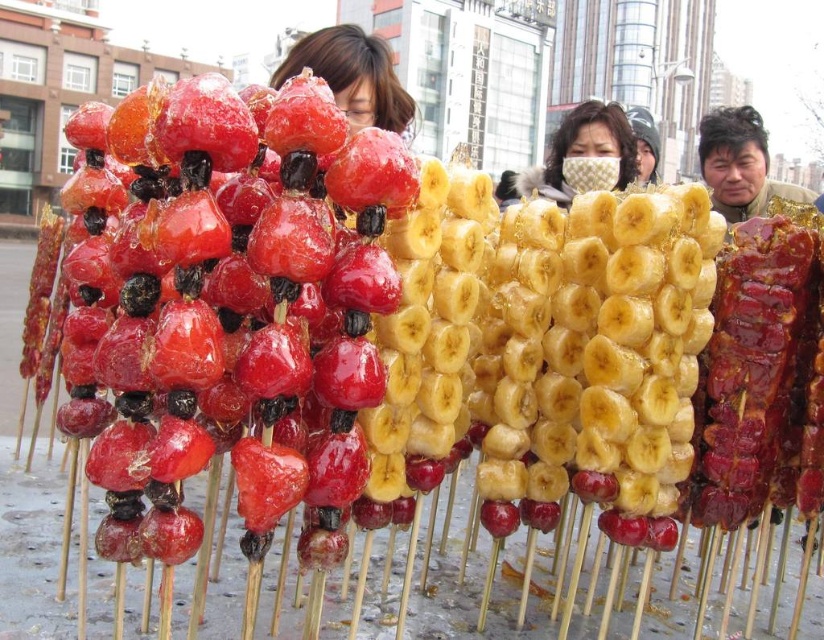
Based on the photo, is yellow/golden smooth banana at center positioned in front of smooth brown jacket at right?

That is True.

Is yellow/golden smooth banana at center further to the viewer compared to smooth brown jacket at right?

No, yellow/golden smooth banana at center is closer to the viewer.

Who is more distant from viewer, (665, 465) or (726, 161)?

The point (726, 161) is more distant.

The image size is (824, 640). I want to click on yellow/golden smooth banana at center, so click(597, 348).

Which is above, yellow/golden smooth banana at center or patterned fabric face mask at center?

patterned fabric face mask at center is higher up.

Who is taller, yellow/golden smooth banana at center or patterned fabric face mask at center?

patterned fabric face mask at center is taller.

Locate an element on the screen. Image resolution: width=824 pixels, height=640 pixels. yellow/golden smooth banana at center is located at coordinates (597, 348).

Does patterned fabric face mask at center have a greater width compared to smooth brown jacket at right?

No, patterned fabric face mask at center is not wider than smooth brown jacket at right.

Which is below, patterned fabric face mask at center or smooth brown jacket at right?

smooth brown jacket at right is lower down.

This screenshot has height=640, width=824. What are the coordinates of `patterned fabric face mask at center` in the screenshot? It's located at (584, 154).